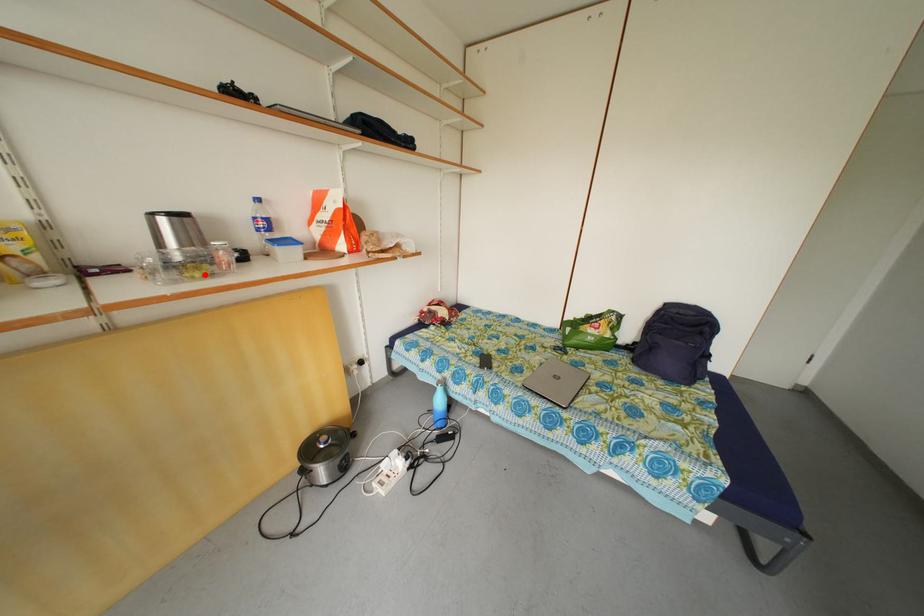
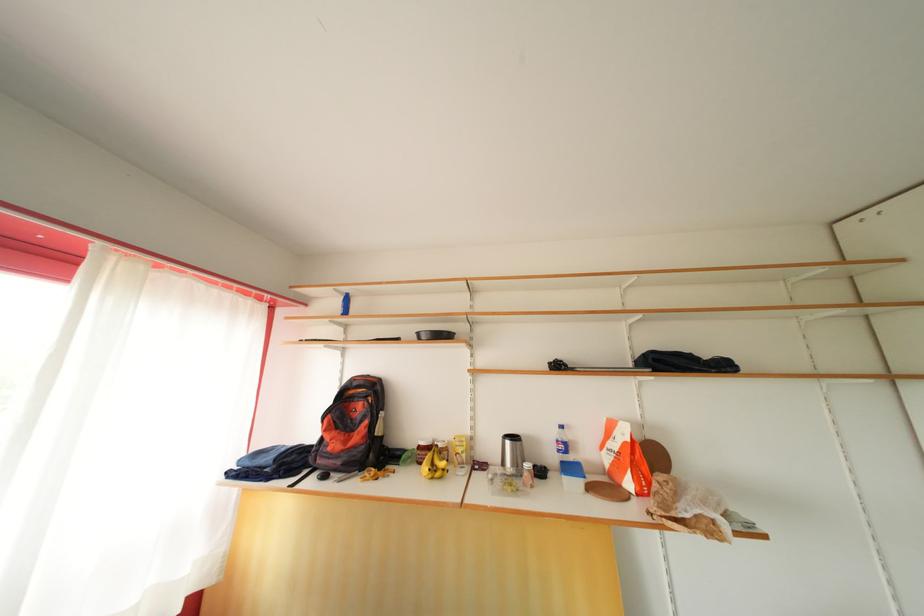
In the second image, find the point that corresponds to the highlighted location in the first image.

(517, 490)